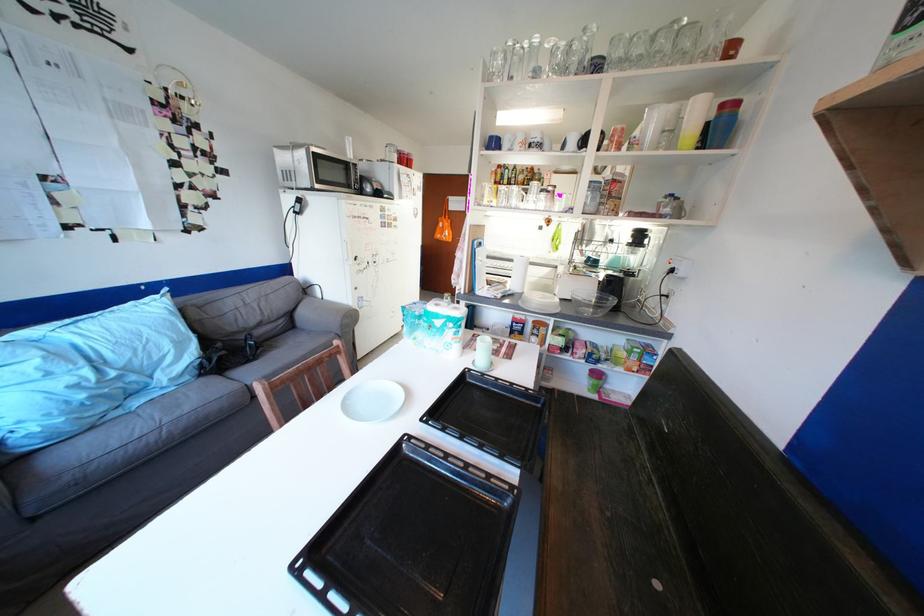
This screenshot has width=924, height=616. What do you see at coordinates (228, 358) in the screenshot?
I see `a grey sofa sitting surface` at bounding box center [228, 358].